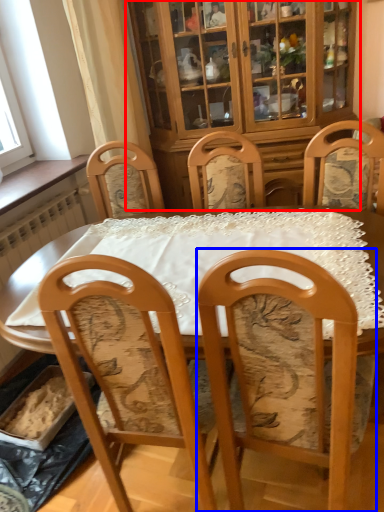
Question: Which object appears closest to the camera in this image, cabinetry (highlighted by a red box) or chair (highlighted by a blue box)?

Choices:
 (A) cabinetry
 (B) chair

Answer: (B)